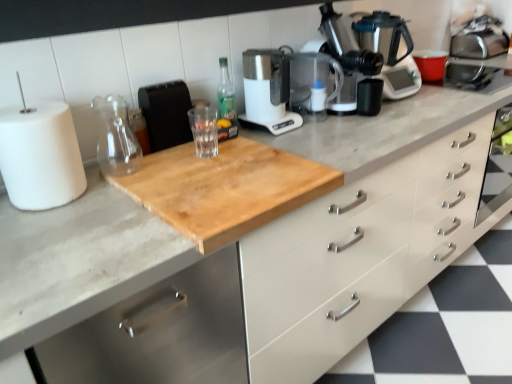
I want to click on free space to the left of transparent glass jar at upper center, which is counted as the second glass jar, starting from the right, so click(97, 168).